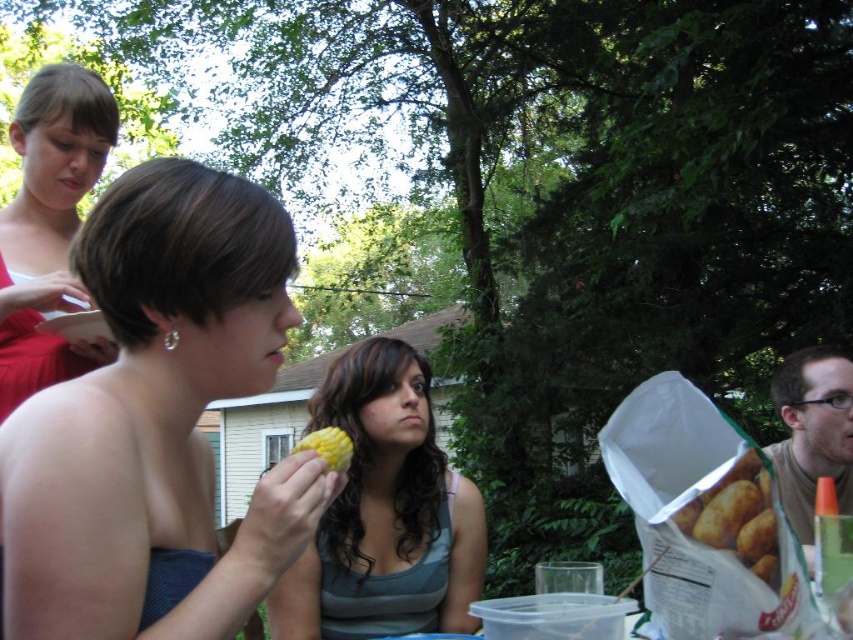
What is located at the coordinate point (735, 515) in the image?

A matte brown potato at lower right is located at the coordinate point (735, 515).

You are a photographer standing in the center of the scene. You want to take a picture that includes both the woman with short brown hair and the matte brown potato at lower right. Based on their positions, where should you position the potato in the frame relative to the woman?

The matte brown potato at lower right is located at point (735, 515) in the frame. Since the woman is on the left side, positioning the potato towards the lower right of the frame would place it relative to her.